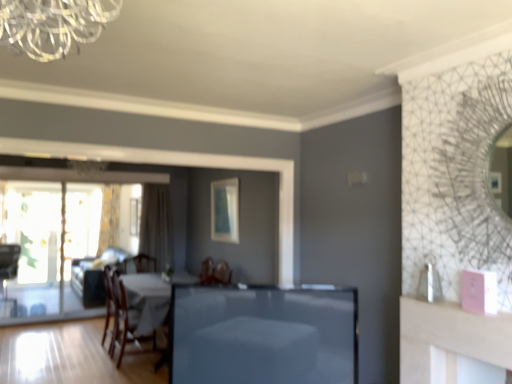
Question: Based on their sizes in the image, would you say matte blue picture frame at center, the first picture frame in the front-to-back sequence, is bigger or smaller than beige fabric curtain at left, which is the 2th curtain from back to front?

Choices:
 (A) small
 (B) big

Answer: (A)

Question: Is matte blue picture frame at center, placed as the 2th picture frame when sorted from left to right, to the left or to the right of beige fabric curtain at left, placed as the first curtain when sorted from right to left, in the image?

Choices:
 (A) left
 (B) right

Answer: (B)

Question: Estimate the real-world distances between objects in this image. Which object is closer to the matte white picture frame at center, the 1th picture frame viewed from the back?

Choices:
 (A) wooden chair at left, marked as the first chair in a left-to-right arrangement
 (B) textured beige curtain at left, the 2th curtain in the right-to-left sequence
 (C) smooth glass table at center
 (D) velvet beige couch at center
 (E) wooden chair at lower left, positioned as the 2th chair in back-to-front order

Answer: (B)

Question: Which is farther from the wooden chair at left, which appears as the 1th chair when viewed from the back?

Choices:
 (A) matte white picture frame at center, the 1th picture frame viewed from the back
 (B) wooden chair at lower left, the first chair positioned from the right
 (C) matte blue picture frame at center, placed as the 2th picture frame when sorted from left to right
 (D) smooth glass table at center
 (E) textured beige curtain at left, the 2th curtain when ordered from front to back

Answer: (D)